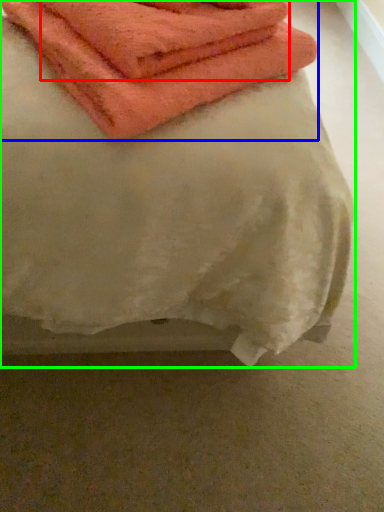
Question: Estimate the real-world distances between objects in this image. Which object is closer to towel (highlighted by a red box), towel (highlighted by a blue box) or towel (highlighted by a green box)?

Choices:
 (A) towel
 (B) towel

Answer: (A)